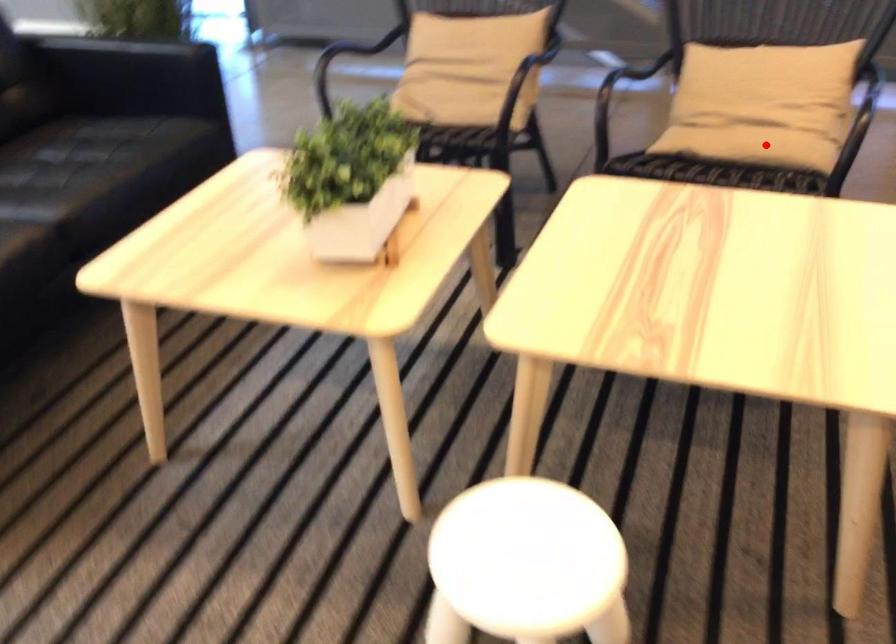
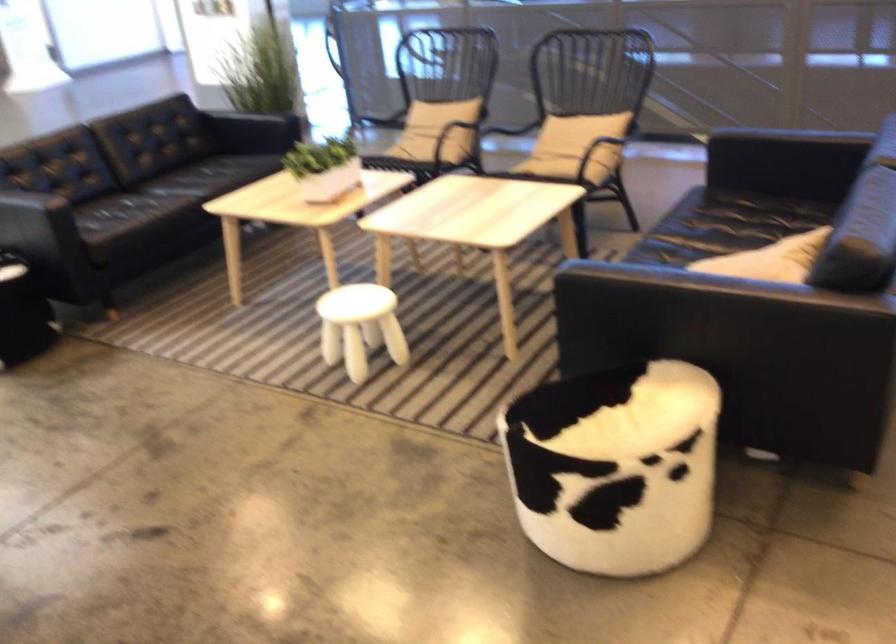
Find the pixel in the second image that matches the highlighted location in the first image.

(552, 160)